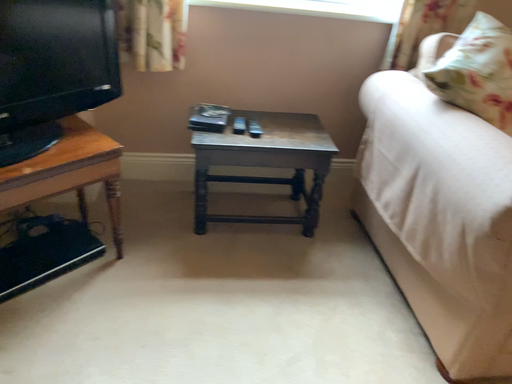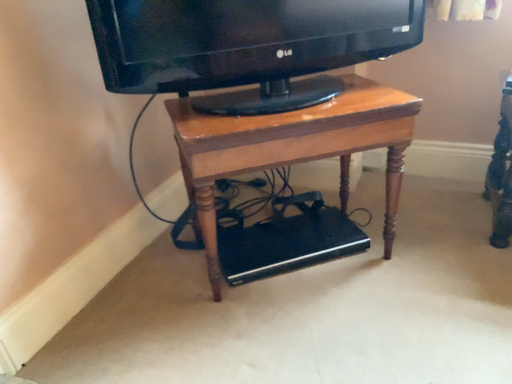
Question: How did the camera likely rotate when shooting the video?

Choices:
 (A) rotated downward
 (B) rotated upward

Answer: (B)